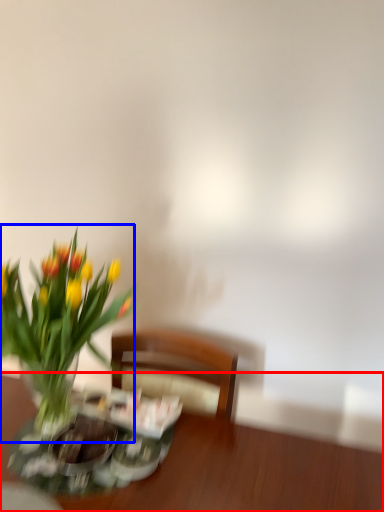
Question: Among these objects, which one is nearest to the camera, table (highlighted by a red box) or flower (highlighted by a blue box)?

Choices:
 (A) table
 (B) flower

Answer: (B)